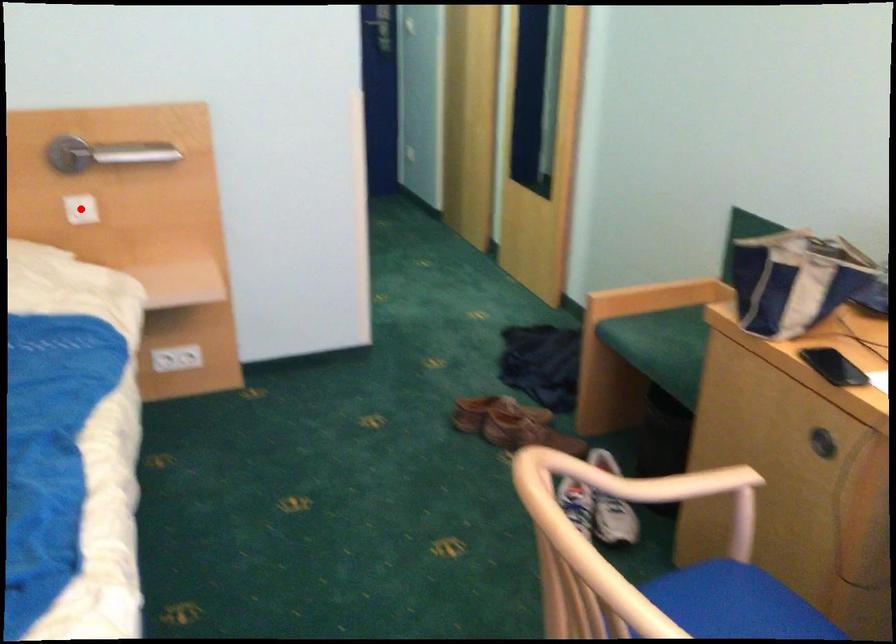
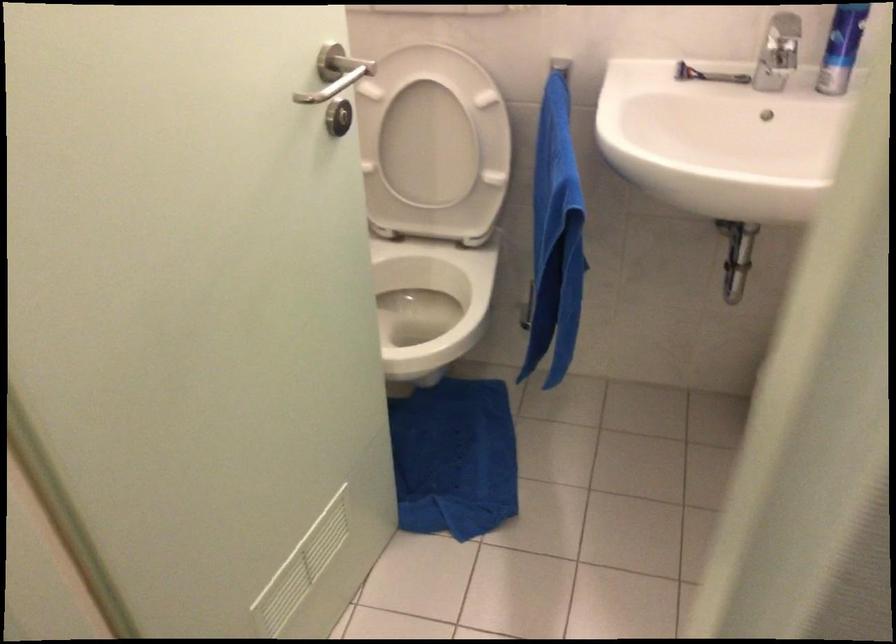
Question: I am providing you with two images of the same scene from different viewpoints. A red point is marked on the first image. At the location where the point appears in image 1, is it still visible in image 2?

Choices:
 (A) Yes
 (B) No

Answer: (B)